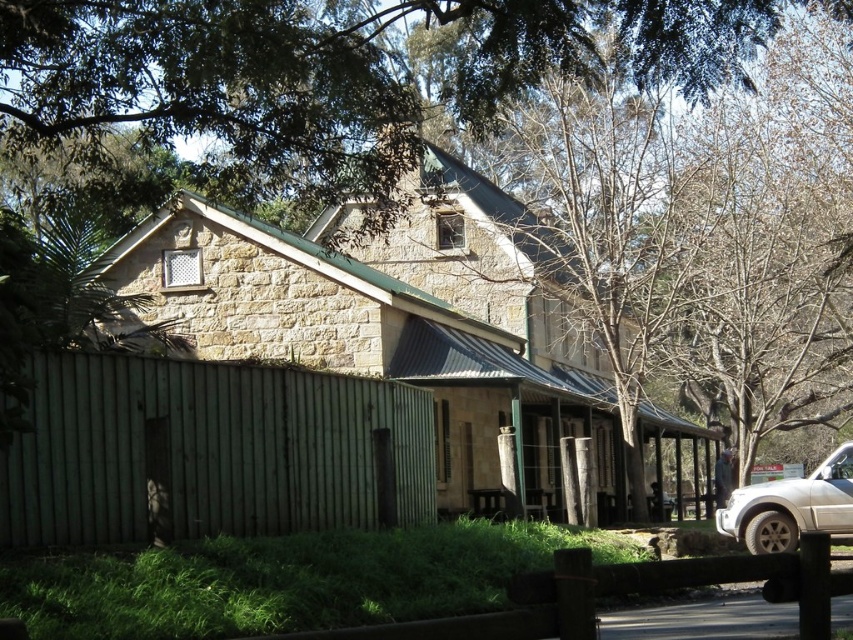
You are a photographer planning to take a picture of the stone church at center and the green wooden fence at lower left. Based on their sizes in the image, which object would appear larger in your photo?

The stone church at center appears larger in the photo because it is much taller than the green wooden fence at lower left.

You are driving a white matte suv at lower right and want to park it in front of the stone church at center. Is it currently positioned in front or behind the church?

The white matte suv at lower right is behind the stone church at center, so it is not parked in front of the church.

You are standing in front of the stone church at center and want to walk to the green wooden fence at lower left. Which direction should you move relative to the church?

The green wooden fence at lower left is behind the stone church at center, so you should move backward away from the church to reach it.